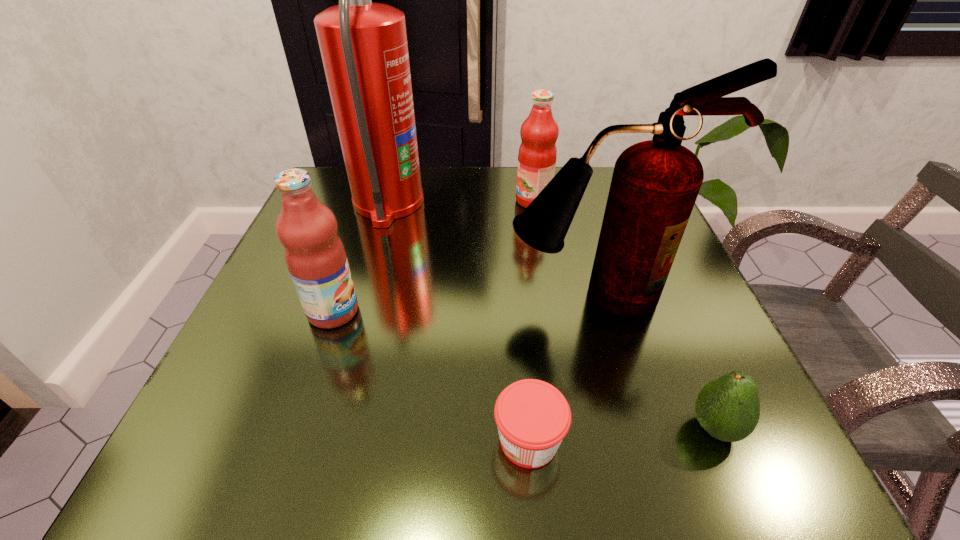
You are a GUI agent. You are given a task and a screenshot of the screen. Output one action in this format:
    pyautogui.click(x=<x>, y=<y>)
    Task: Click on the tallest object
    The width and height of the screenshot is (960, 540).
    Given the screenshot: What is the action you would take?
    pyautogui.click(x=363, y=45)

The height and width of the screenshot is (540, 960). I want to click on the taller fire extinguisher, so click(363, 45).

Where is `the fifth shortest object`? The width and height of the screenshot is (960, 540). the fifth shortest object is located at coordinates (655, 183).

Where is `the shorter fire extinguisher`? The image size is (960, 540). the shorter fire extinguisher is located at coordinates (655, 183).

The image size is (960, 540). Identify the location of the nearer fruit juice. (315, 256).

Find the location of a particular element. the right fruit juice is located at coordinates (537, 155).

Identify the location of the fifth tallest object. (728, 408).

Where is `the shortest object`? This screenshot has height=540, width=960. the shortest object is located at coordinates tap(532, 416).

The height and width of the screenshot is (540, 960). I want to click on vacant region located 0.100m on the instruction side of the left fire extinguisher, so click(x=468, y=204).

Locate an element on the screen. vacant space situated at the nozzle of the fifth shortest object is located at coordinates (642, 453).